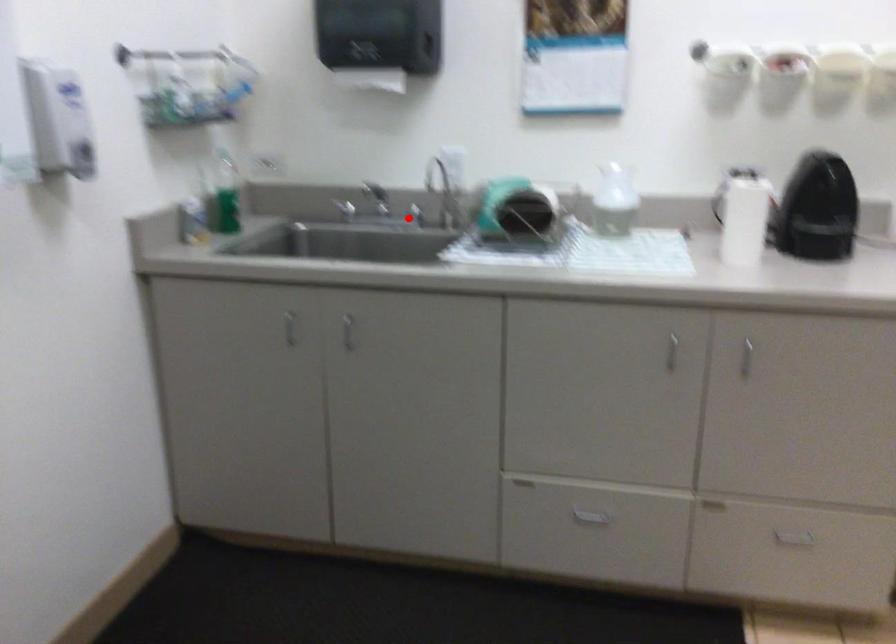
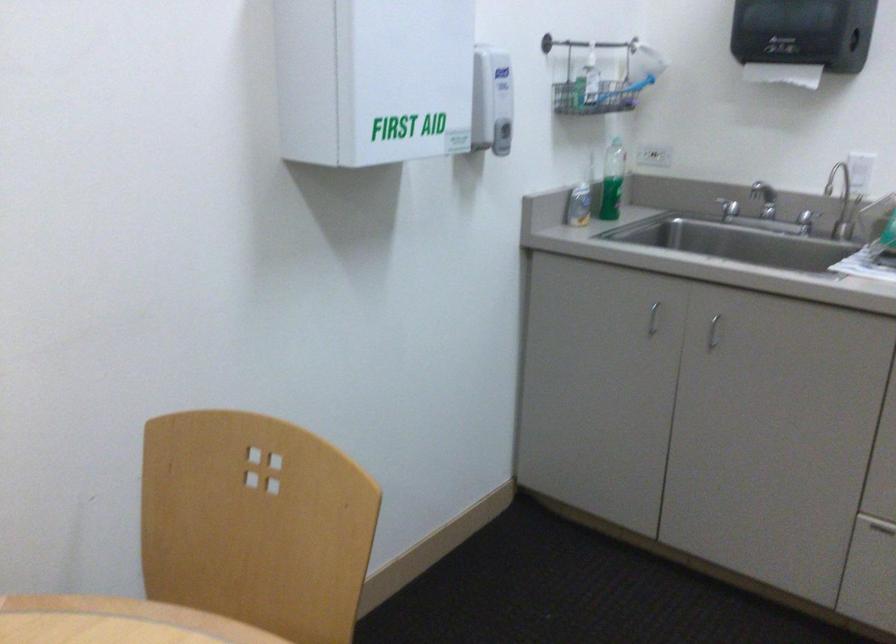
Question: I am providing you with two images of the same scene from different viewpoints. In image1, a red point is highlighted. Considering the same 3D point in image2, which of the following is correct?

Choices:
 (A) It is closer
 (B) It is farther

Answer: (A)